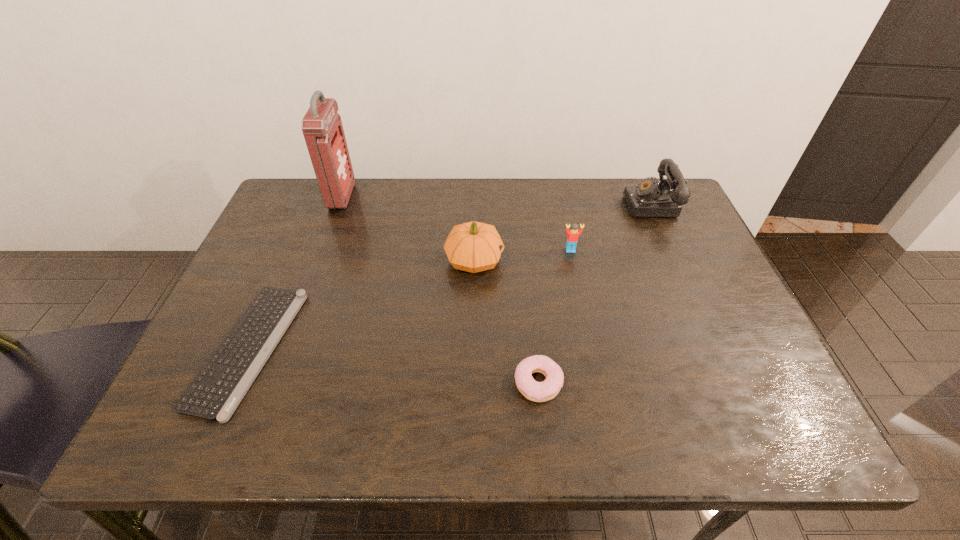
In order to click on the first-aid kit present at the left edge in this screenshot , I will do `click(322, 128)`.

Locate an element on the screen. The image size is (960, 540). computer keyboard at the left edge is located at coordinates (217, 390).

Find the location of a particular element. The image size is (960, 540). object present at the right edge is located at coordinates (649, 198).

The height and width of the screenshot is (540, 960). In order to click on object that is at the far left corner in this screenshot , I will do tap(322, 128).

Find the location of a particular element. This screenshot has height=540, width=960. object at the near left corner is located at coordinates (217, 390).

You are a GUI agent. You are given a task and a screenshot of the screen. Output one action in this format:
    pyautogui.click(x=<x>, y=<y>)
    Task: Click on the object that is at the far right corner
    This screenshot has width=960, height=540.
    Given the screenshot: What is the action you would take?
    pyautogui.click(x=649, y=198)

At what (x,y) coordinates should I click in order to perform the action: click on free location at the far edge. Please return your answer as a coordinate pair (x, y). Looking at the image, I should click on (576, 215).

Locate an element on the screen. The image size is (960, 540). free region at the near edge of the desktop is located at coordinates (590, 434).

In the image, there is a desktop. Where is `free region at the left edge`? free region at the left edge is located at coordinates (271, 356).

At what (x,y) coordinates should I click in order to perform the action: click on blank space at the right edge of the desktop. Please return your answer as a coordinate pair (x, y). Looking at the image, I should click on (734, 390).